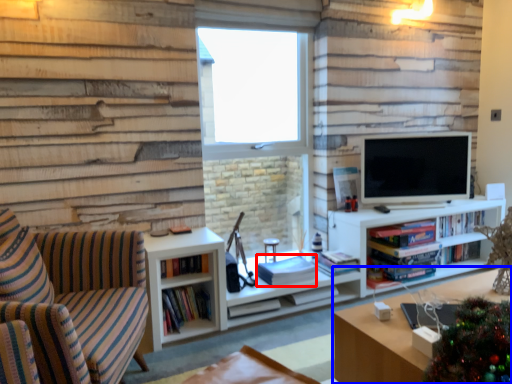
Question: Which point is closer to the camera, book (highlighted by a red box) or table (highlighted by a blue box)?

Choices:
 (A) book
 (B) table

Answer: (B)